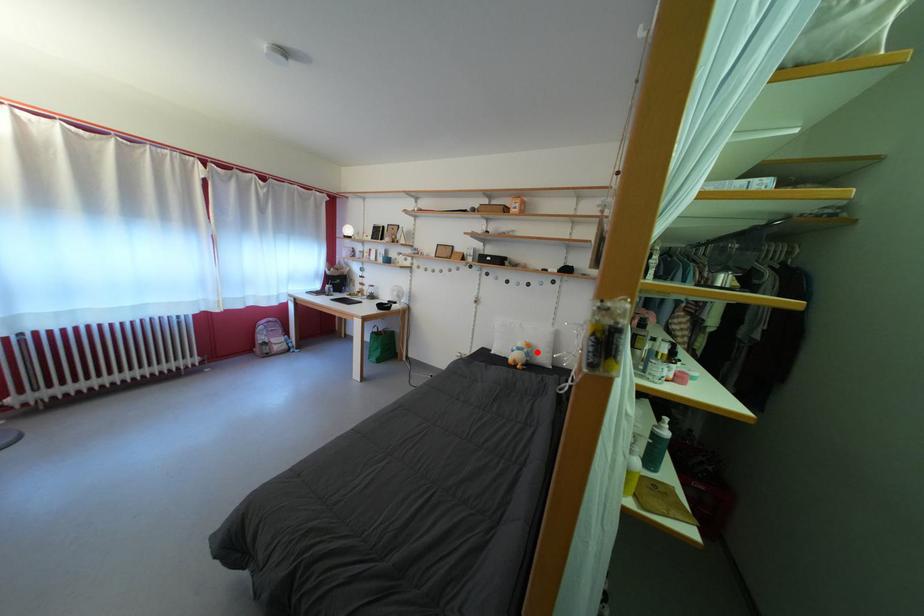
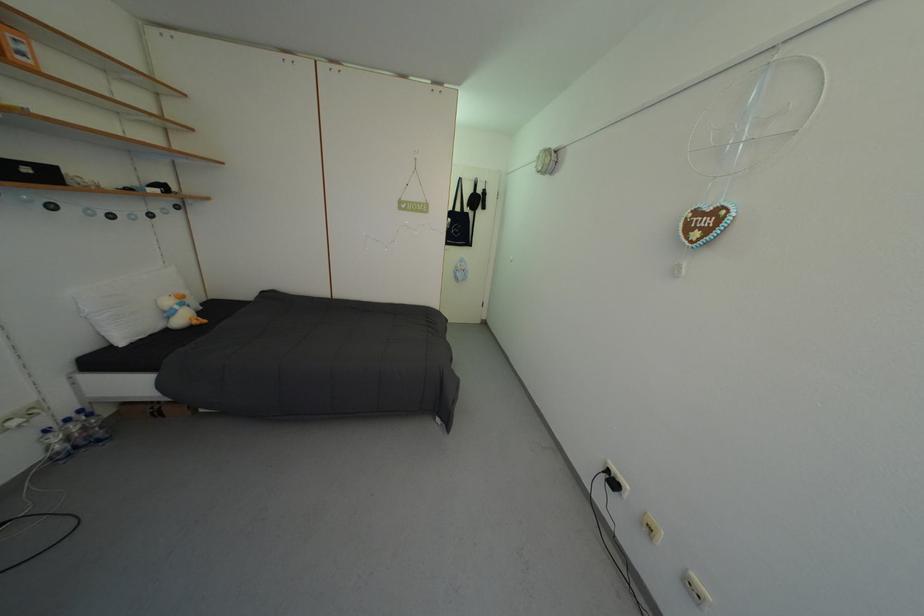
Where in the second image is the point corresponding to the highlighted location from the first image?

(190, 302)